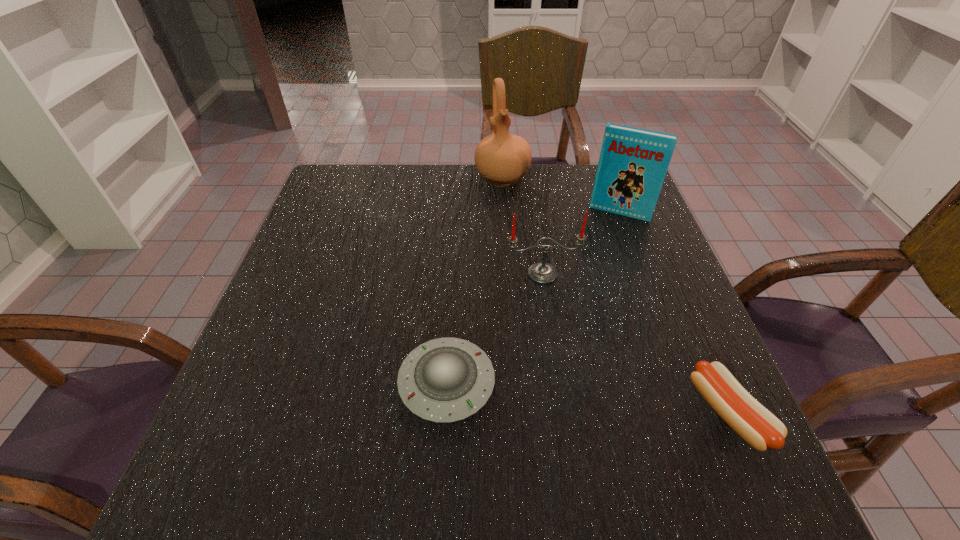
At what (x,y) coordinates should I click in order to perform the action: click on vacant space on the desktop that is between the saucer and the sausage and is positioned on the front cover of the book. Please return your answer as a coordinate pair (x, y). This screenshot has height=540, width=960. Looking at the image, I should click on (556, 395).

Where is `free space on the desktop that is between the saucer and the sausage and is positioned on the front-facing side of the third shortest object`? free space on the desktop that is between the saucer and the sausage and is positioned on the front-facing side of the third shortest object is located at coordinates (573, 396).

What are the coordinates of `free spot on the desktop that is between the saucer and the sausage and is positioned on the spout of the pottery` in the screenshot? It's located at (558, 395).